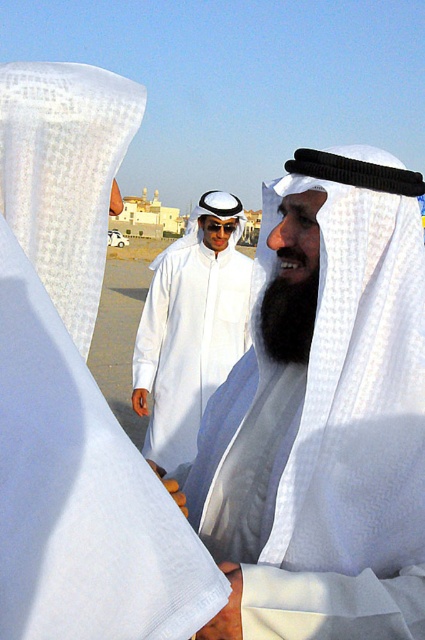
You are standing at the point marked as point [325,419]. Which object is directly in front of you?

The white textured robe at center is located at point [325,419], so it is directly in front of you.